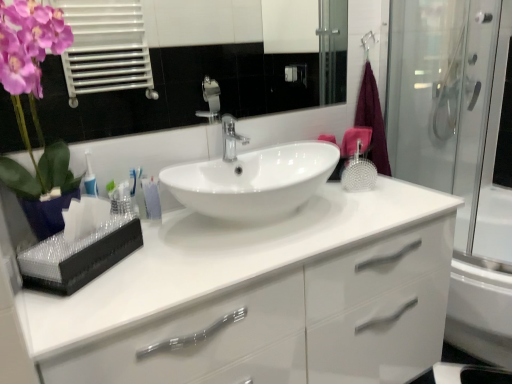
Question: Is glossy ceramic mirror at upper center wider than white glossy cabinet at center?

Choices:
 (A) no
 (B) yes

Answer: (A)

Question: From the image's perspective, is glossy ceramic mirror at upper center located beneath white glossy cabinet at center?

Choices:
 (A) yes
 (B) no

Answer: (B)

Question: Is white glossy cabinet at center inside glossy ceramic mirror at upper center?

Choices:
 (A) no
 (B) yes

Answer: (A)

Question: Is glossy ceramic mirror at upper center touching white glossy cabinet at center?

Choices:
 (A) no
 (B) yes

Answer: (A)

Question: Is glossy ceramic mirror at upper center shorter than white glossy cabinet at center?

Choices:
 (A) no
 (B) yes

Answer: (B)

Question: Is glossy ceramic mirror at upper center looking in the opposite direction of white glossy cabinet at center?

Choices:
 (A) yes
 (B) no

Answer: (B)

Question: Is white glossy sink at center to the left of polished chrome faucet at center from the viewer's perspective?

Choices:
 (A) no
 (B) yes

Answer: (A)

Question: Is polished chrome faucet at center completely or partially inside white glossy sink at center?

Choices:
 (A) yes
 (B) no

Answer: (B)

Question: From the image's perspective, is white glossy sink at center over polished chrome faucet at center?

Choices:
 (A) no
 (B) yes

Answer: (A)

Question: Considering the relative sizes of white glossy sink at center and polished chrome faucet at center in the image provided, is white glossy sink at center wider than polished chrome faucet at center?

Choices:
 (A) yes
 (B) no

Answer: (A)

Question: Can you confirm if white glossy sink at center is shorter than polished chrome faucet at center?

Choices:
 (A) yes
 (B) no

Answer: (B)

Question: Does white glossy sink at center have a larger size compared to polished chrome faucet at center?

Choices:
 (A) no
 (B) yes

Answer: (B)

Question: Can you confirm if transparent glass shower door at right is shorter than maroon fabric bath towel at right?

Choices:
 (A) no
 (B) yes

Answer: (A)